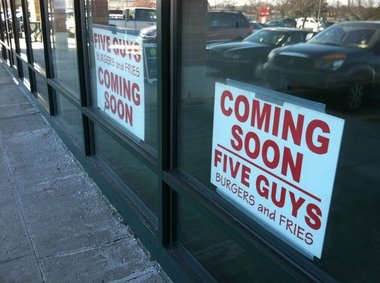
Where is `door handle`? This screenshot has width=380, height=283. door handle is located at coordinates (7, 27).